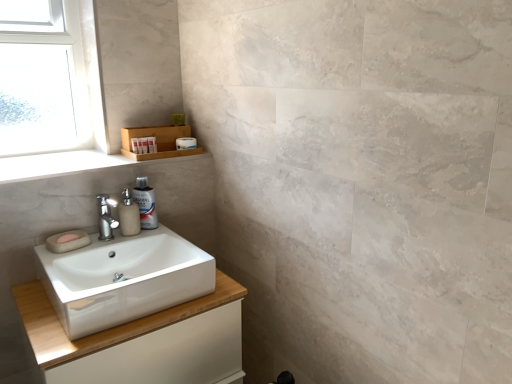
I want to click on empty space that is ontop of wooden tray at upper left (from a real-world perspective), so click(x=73, y=159).